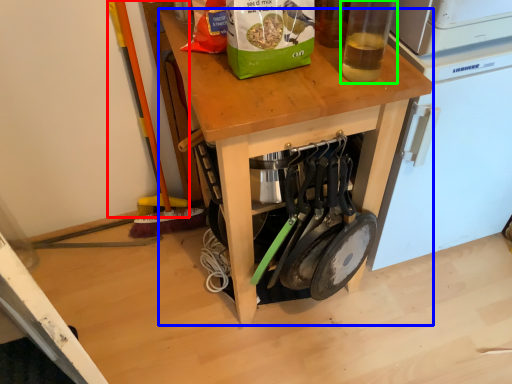
Question: Which is nearer to the brush (highlighted by a red box)? desk (highlighted by a blue box) or bottle (highlighted by a green box).

Choices:
 (A) desk
 (B) bottle

Answer: (A)